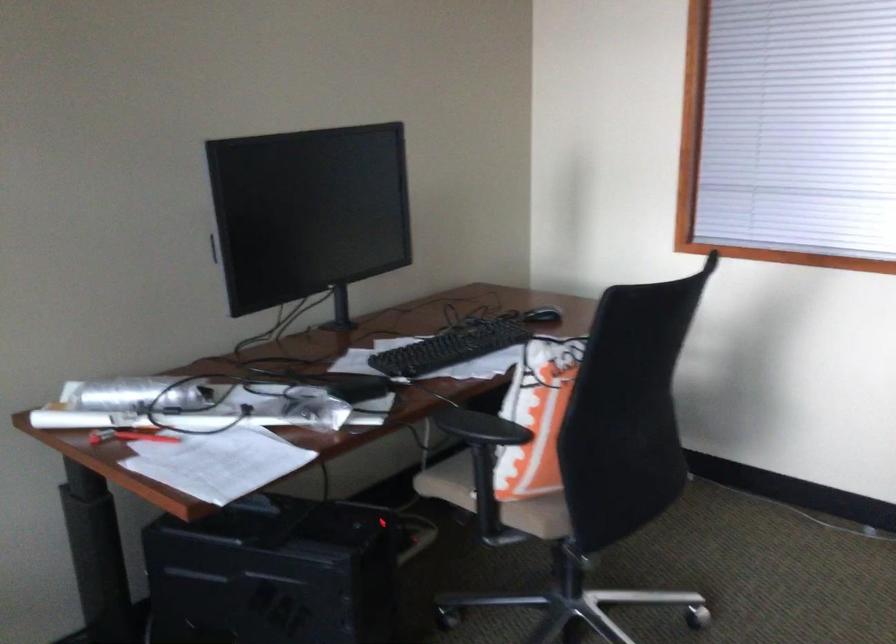
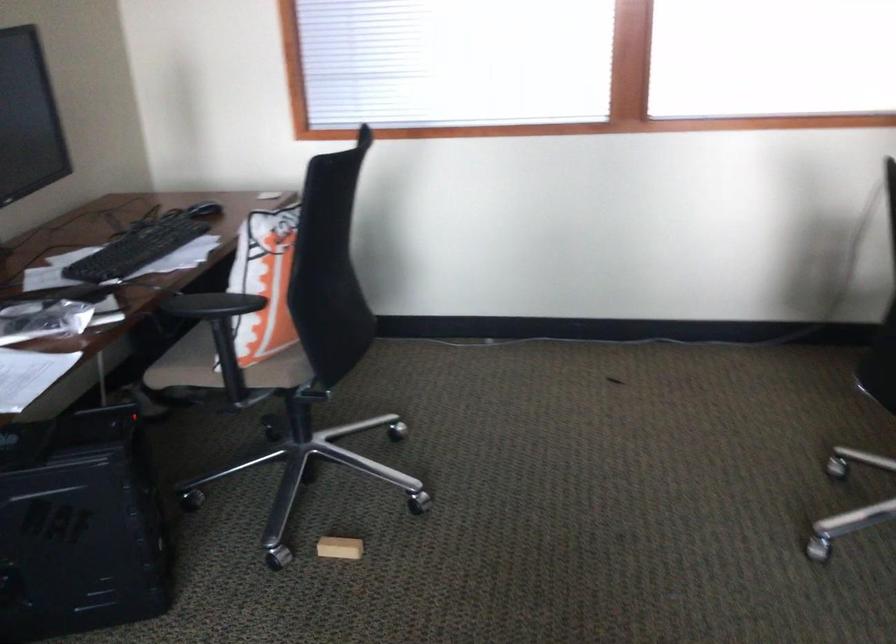
Find the pixel in the second image that matches point 441,348 in the first image.

(138, 248)